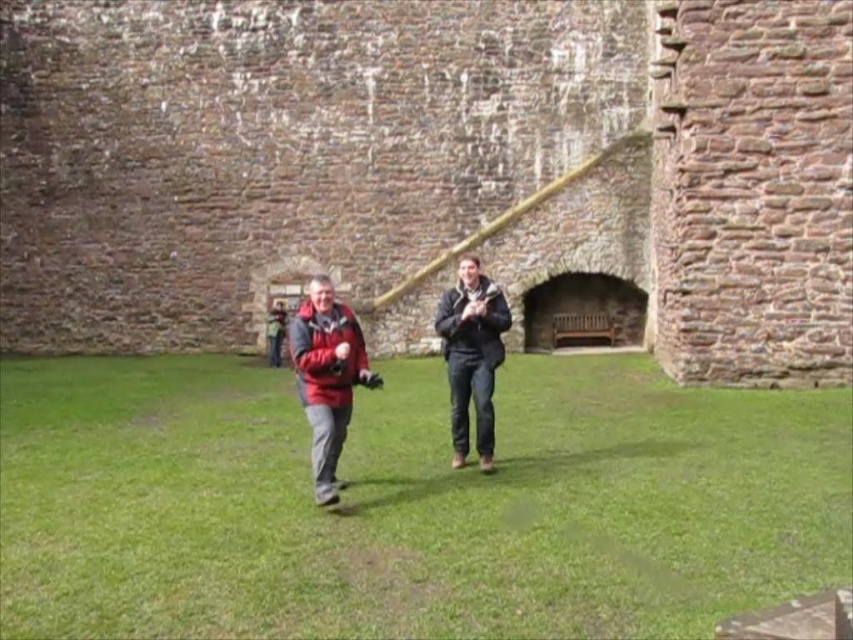
Is matte red jacket at center wider than dark brown leather jacket at center?

Yes.

Measure the distance between matte red jacket at center and camera.

matte red jacket at center and camera are 23.72 meters apart from each other.

Identify the location of matte red jacket at center. (328, 378).

Who is more distant from viewer, [160,312] or [698,433]?

Positioned behind is point [160,312].

Between brick wall at center and green grass at center, which one has more height?

brick wall at center is taller.

Is point (753, 56) in front of point (21, 547)?

No, (753, 56) is behind (21, 547).

In order to click on brick wall at center in this screenshot , I will do `click(432, 172)`.

Describe the element at coordinates (409, 502) in the screenshot. I see `green grass at center` at that location.

Is point (567, 589) positioned after point (485, 332)?

No, (567, 589) is in front of (485, 332).

What do you see at coordinates (409, 502) in the screenshot?
I see `green grass at center` at bounding box center [409, 502].

Locate an element on the screen. The width and height of the screenshot is (853, 640). green grass at center is located at coordinates (409, 502).